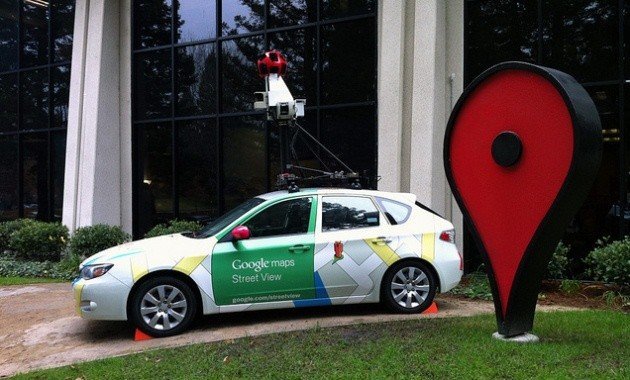
Where is `windows`? The image size is (630, 380). windows is located at coordinates (186, 103).